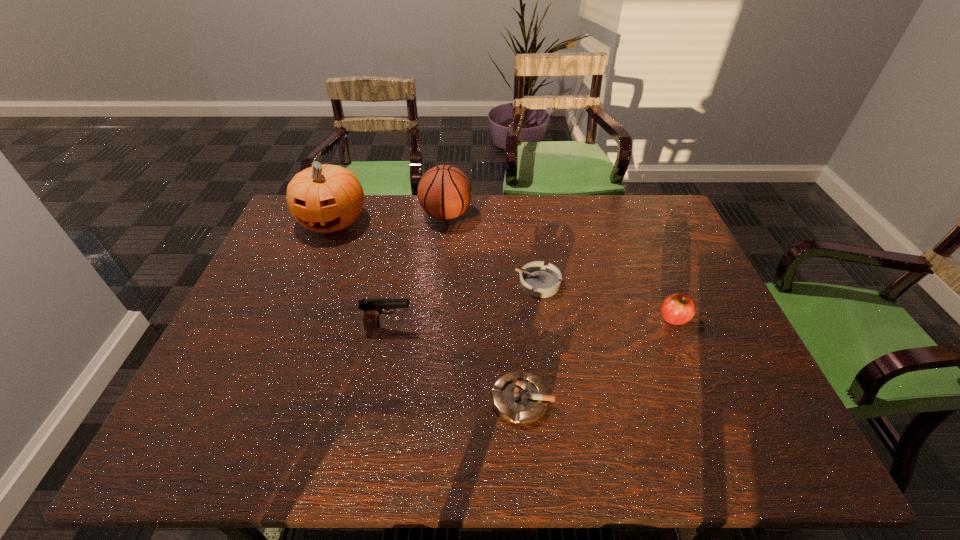
Locate an element on the screen. The height and width of the screenshot is (540, 960). free spot between the nearer ashtray and the leftmost object is located at coordinates (427, 310).

The width and height of the screenshot is (960, 540). I want to click on free space between the farther ashtray and the nearest object, so click(x=530, y=341).

Find the location of a particular element. Image resolution: width=960 pixels, height=540 pixels. vacant space in between the pistol and the fifth shortest object is located at coordinates (418, 271).

The width and height of the screenshot is (960, 540). I want to click on vacant region between the nearer ashtray and the tallest object, so click(427, 310).

Find the location of a particular element. This screenshot has width=960, height=540. the third closest object to the pistol is located at coordinates (325, 198).

The width and height of the screenshot is (960, 540). Identify the location of the second closest object to the fourth nearest object. (677, 309).

Locate an element on the screen. vacant region that satisfies the following two spatial constraints: 1. on the side where the inflation valve is located; 2. on the back side of the fourth tallest object is located at coordinates (437, 318).

The height and width of the screenshot is (540, 960). I want to click on free location that satisfies the following two spatial constraints: 1. at the barrel of the fourth shortest object; 2. on the back side of the nearest object, so click(x=374, y=400).

Find the location of a particular element. The height and width of the screenshot is (540, 960). blank space that satisfies the following two spatial constraints: 1. on the front-facing side of the tallest object; 2. on the left side of the farther ashtray is located at coordinates (307, 284).

Where is `blank space that satisfies the following two spatial constraints: 1. on the side where the inflation valve is located; 2. on the left side of the second tallest object`? blank space that satisfies the following two spatial constraints: 1. on the side where the inflation valve is located; 2. on the left side of the second tallest object is located at coordinates (440, 284).